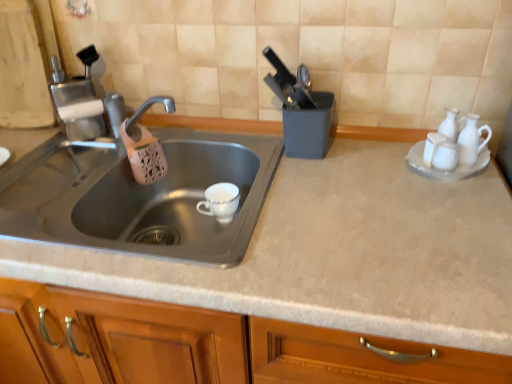
What are the coordinates of `vacant point to the right of matte plastic knife block at upper right` in the screenshot? It's located at (368, 152).